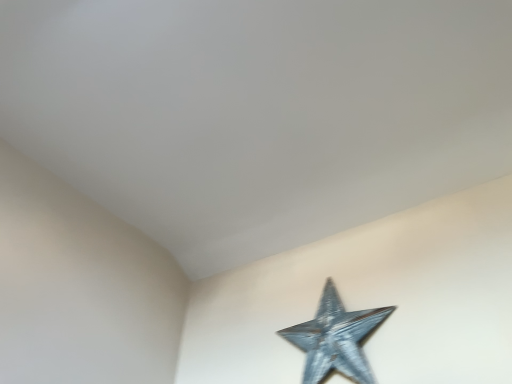
Measure the distance between metallic silver star at lower center and camera.

The distance of metallic silver star at lower center from camera is 4.77 feet.

Describe the element at coordinates (336, 338) in the screenshot. I see `metallic silver star at lower center` at that location.

Locate an element on the screen. The width and height of the screenshot is (512, 384). metallic silver star at lower center is located at coordinates (336, 338).

Image resolution: width=512 pixels, height=384 pixels. Find the location of `metallic silver star at lower center`. metallic silver star at lower center is located at coordinates (336, 338).